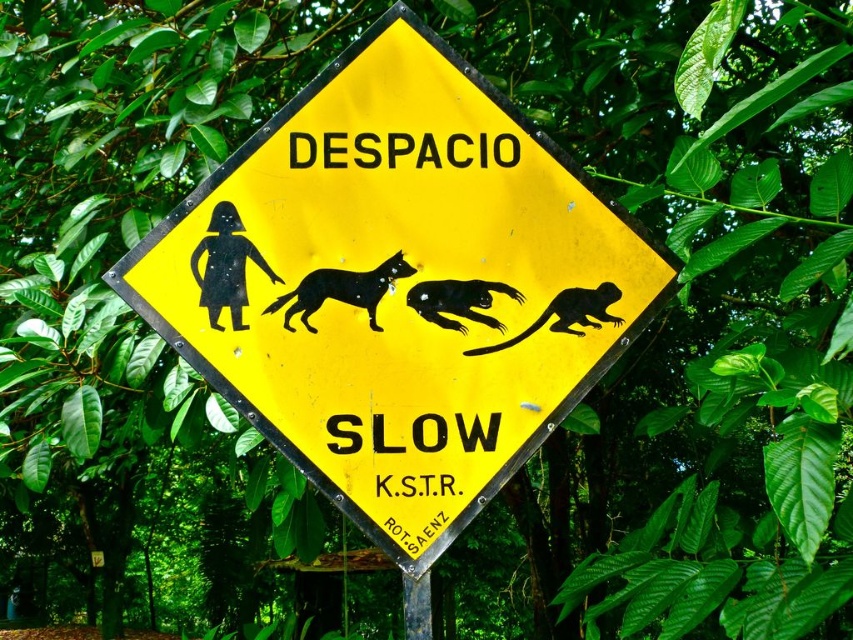
You are a delivery drone that needs to fly through the space between the yellow plastic sign at center and the black rubber monkey at center. Your drone has a wingspan of 15 centimeters. Can you safely pass through this gap without touching either object?

The yellow plastic sign at center is 15.87 centimeters away from the black rubber monkey at center. Since your drone has a wingspan of 15 centimeters, which is slightly smaller than the 15.87 cm gap, you can safely pass through the space between them without touching either object.

You are standing 10 feet away from the road sign. If you move forward 4 feet, will you be closer to the point at coordinate point (302,116)?

Yes, moving forward 4 feet from 10 feet away reduces the distance to 6.25 feet, which is closer than the original 10 feet. However, the point is only 5.75 feet from the viewer, so you would still be 0.5 feet away from it.

You are driving a car that is 1.8 meters wide. You see the black glossy dog at center and the metallic gray pole at lower center. Can your car pass between them without touching either?

The black glossy dog at center might be wider than metallic gray pole at lower center, so there is uncertainty about the available space. To ensure safety, it is advisable to avoid passing between them until the exact width is confirmed.